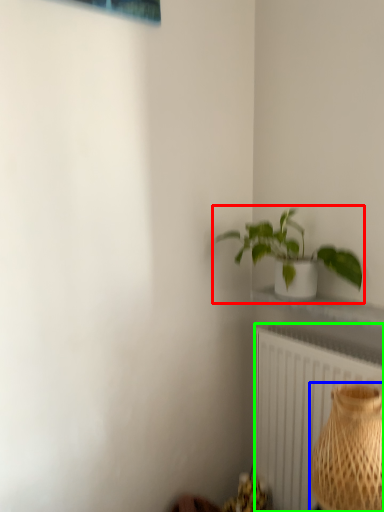
Question: Estimate the real-world distances between objects in this image. Which object is farther from houseplant (highlighted by a red box), vase (highlighted by a blue box) or radiator (highlighted by a green box)?

Choices:
 (A) vase
 (B) radiator

Answer: (A)